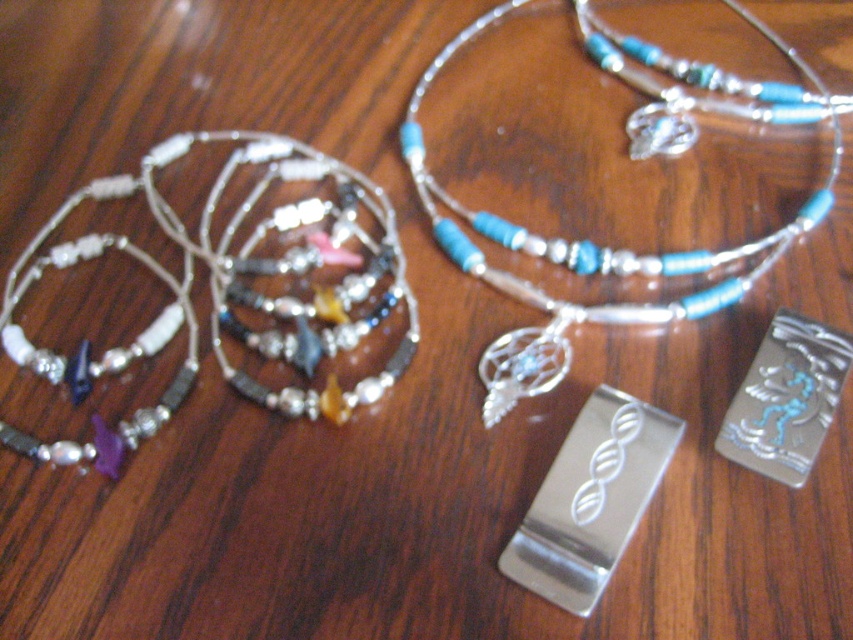
Can you confirm if multicolored beaded necklace at left is positioned above polished metal bookmark at center?

Correct, multicolored beaded necklace at left is located above polished metal bookmark at center.

Can you confirm if multicolored beaded necklace at left is shorter than polished metal bookmark at center?

No.

Is point (270, 333) farther from viewer compared to point (547, 525)?

Yes, it is.

Locate an element on the screen. This screenshot has height=640, width=853. multicolored beaded necklace at left is located at coordinates (245, 276).

What do you see at coordinates (563, 262) in the screenshot?
I see `blue beaded necklace at center` at bounding box center [563, 262].

Is blue beaded necklace at center to the right of polished metal bookmark at center from the viewer's perspective?

Correct, you'll find blue beaded necklace at center to the right of polished metal bookmark at center.

Is point (476, 28) behind point (637, 444)?

Yes, it is behind point (637, 444).

Identify the location of blue beaded necklace at center. (563, 262).

Who is lower down, multicolored beaded necklace at left or blue beaded necklace at center?

multicolored beaded necklace at left is lower down.

Is multicolored beaded necklace at left bigger than blue beaded necklace at center?

Incorrect, multicolored beaded necklace at left is not larger than blue beaded necklace at center.

Who is more forward, (178, 392) or (540, 237)?

Point (178, 392) is more forward.

Find the location of `multicolored beaded necklace at left`. multicolored beaded necklace at left is located at coordinates (245, 276).